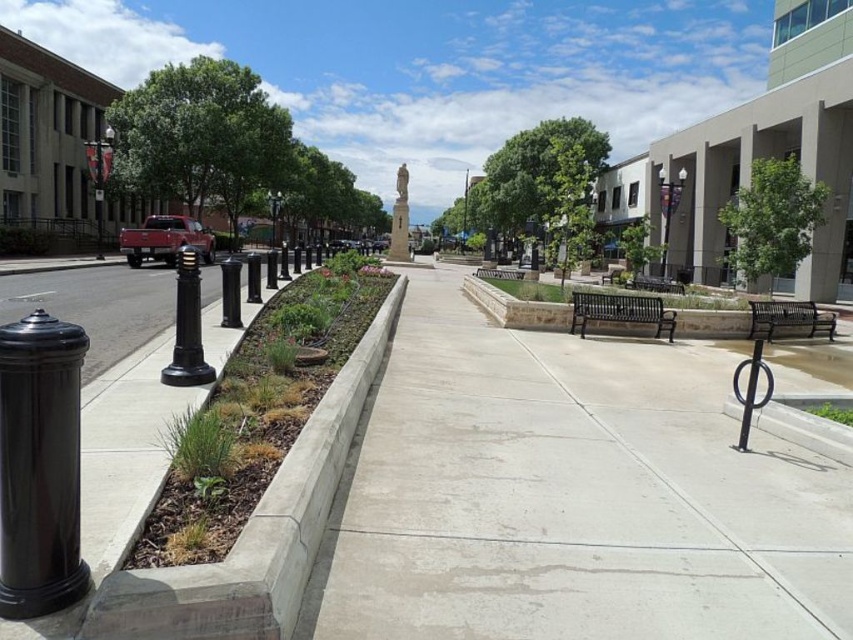
You are standing in the plaza and want to take a photo that includes both the statue and the red pickup truck. The statue is at point [68,364] and the truck is at point [402,163]. Which point should you focus on first to ensure both are in sharp focus?

You should focus on point [68,364] first because it is closer to the camera than point [402,163], ensuring the statue is in focus while the truck will also be within the depth of field.

You are a city planner reviewing the plaza layout. You need to install a new security camera that can monitor both the black polished pillar at left and the stone statue at center. Where should you place the camera to ensure both are in view?

The black polished pillar at left is below the stone statue at center, so placing the camera at a higher elevation above the stone statue at center would allow it to capture both the pillar and the statue in its field of view.